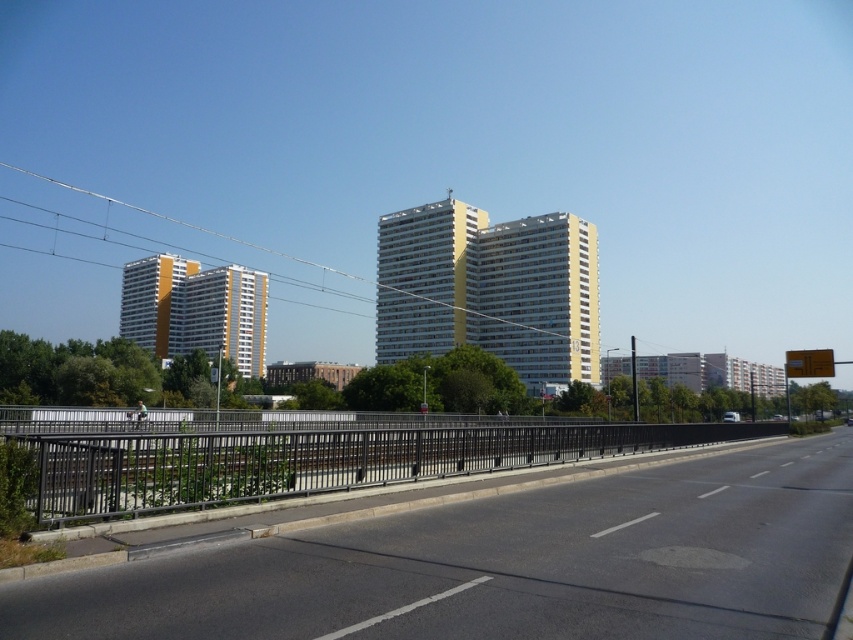
Can you confirm if black asphalt highway at center is taller than metallic wire at upper center?

No.

Who is more forward, (595,609) or (465,296)?

Positioned in front is point (595,609).

The height and width of the screenshot is (640, 853). In order to click on black asphalt highway at center in this screenshot , I will do `click(508, 564)`.